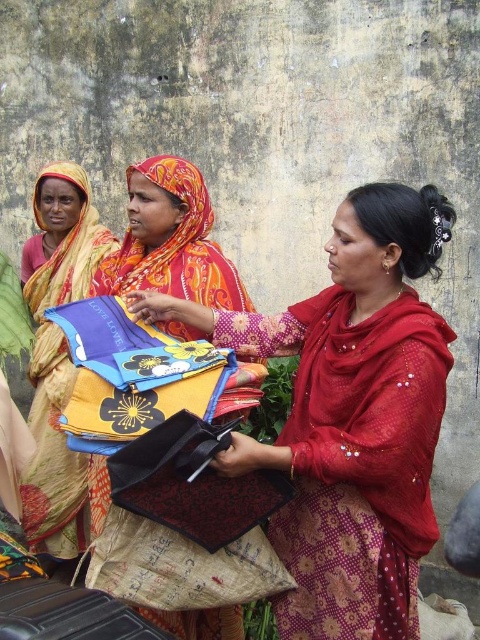
Consider the image. You are a photographer trying to capture the two women in the scene. You want to ensure that both the red sheer saree at center and the matte yellow sari at left are clearly visible in your photo. Based on their positions, which sari will appear larger in the photograph?

The red sheer saree at center will appear larger in the photograph because it is closer to the viewer than the matte yellow sari at left.

You are a photographer standing in front of the three women. You want to take a photo that captures both the matte red saree at center and the matte yellow sari at left. Which woman should you focus on first to ensure both are in frame?

You should focus on the matte red saree at center first because it is closer to the viewer than the matte yellow sari at left, ensuring both are in frame.